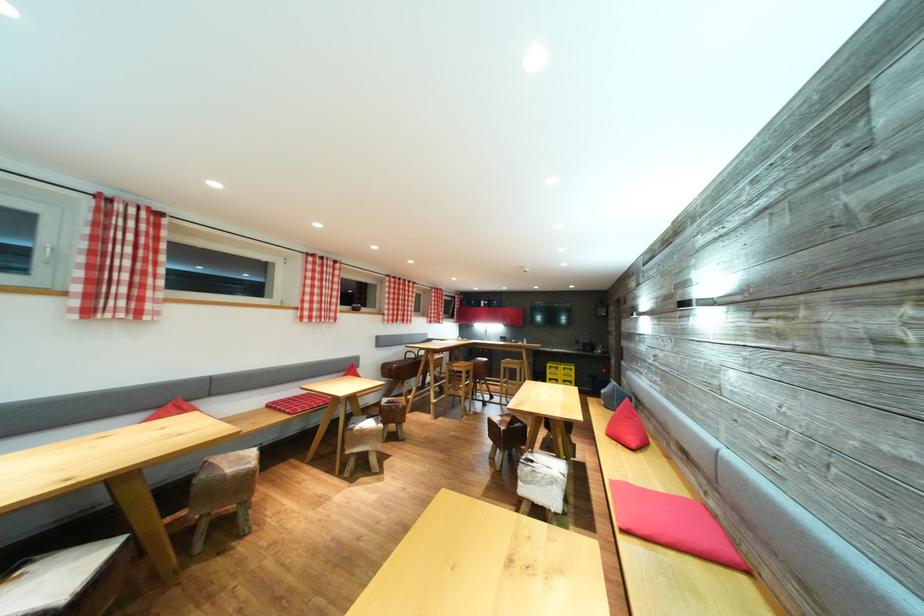
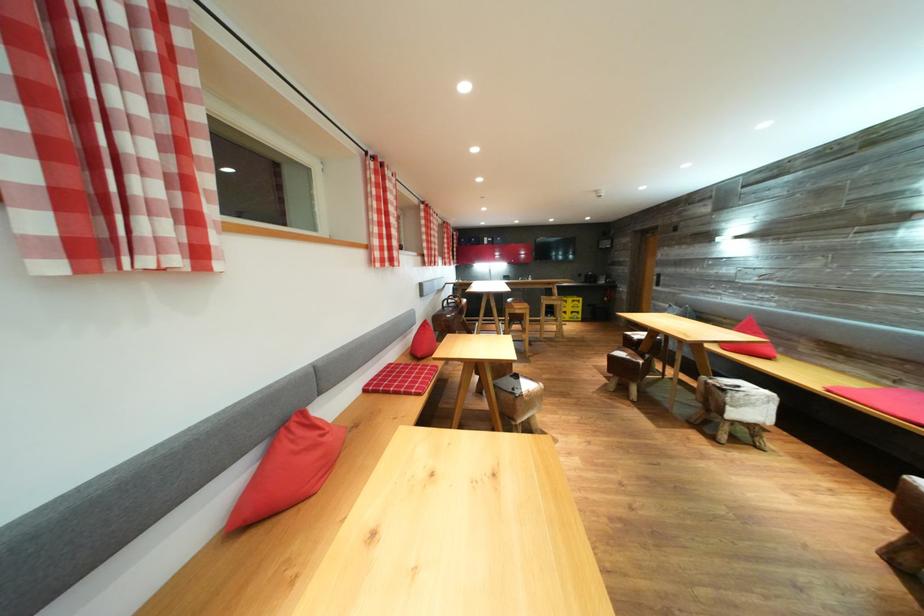
What movement of the cameraman would produce the second image?

The cameraman moved toward left, forward.